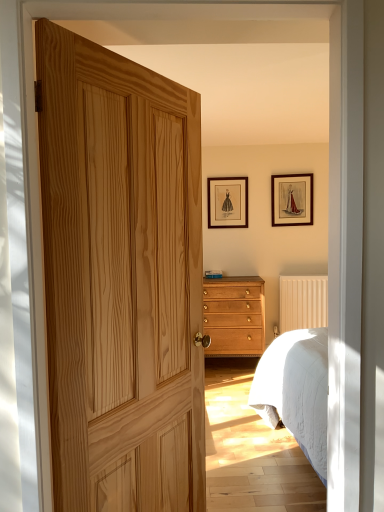
Question: Is natural wood door at center located within light brown wood chest of drawers at center?

Choices:
 (A) no
 (B) yes

Answer: (A)

Question: Is light brown wood chest of drawers at center located outside natural wood door at center?

Choices:
 (A) no
 (B) yes

Answer: (B)

Question: Is light brown wood chest of drawers at center taller than natural wood door at center?

Choices:
 (A) yes
 (B) no

Answer: (B)

Question: Are light brown wood chest of drawers at center and natural wood door at center making contact?

Choices:
 (A) no
 (B) yes

Answer: (A)

Question: Is light brown wood chest of drawers at center positioned with its back to natural wood door at center?

Choices:
 (A) yes
 (B) no

Answer: (B)

Question: Is the depth of light brown wood chest of drawers at center less than that of natural wood door at center?

Choices:
 (A) yes
 (B) no

Answer: (B)

Question: From the image's perspective, does matte black picture frame at upper center, which is the 1th picture frame from left to right, appear lower than natural wood door at center?

Choices:
 (A) yes
 (B) no

Answer: (B)

Question: Is matte black picture frame at upper center, which is the 1th picture frame from left to right, far from natural wood door at center?

Choices:
 (A) no
 (B) yes

Answer: (B)

Question: Can you confirm if matte black picture frame at upper center, which is the 1th picture frame from left to right, is positioned to the left of natural wood door at center?

Choices:
 (A) no
 (B) yes

Answer: (A)

Question: From a real-world perspective, is matte black picture frame at upper center, marked as the second picture frame in a right-to-left arrangement, physically above natural wood door at center?

Choices:
 (A) yes
 (B) no

Answer: (A)

Question: Can you confirm if matte black picture frame at upper center, which is the 1th picture frame from left to right, is positioned to the right of natural wood door at center?

Choices:
 (A) no
 (B) yes

Answer: (B)

Question: From a real-world perspective, is matte black picture frame at upper center, marked as the second picture frame in a right-to-left arrangement, physically below natural wood door at center?

Choices:
 (A) yes
 (B) no

Answer: (B)

Question: Does natural wood door at center have a greater width compared to matte black picture frame at upper center, which is the 1th picture frame from left to right?

Choices:
 (A) yes
 (B) no

Answer: (A)